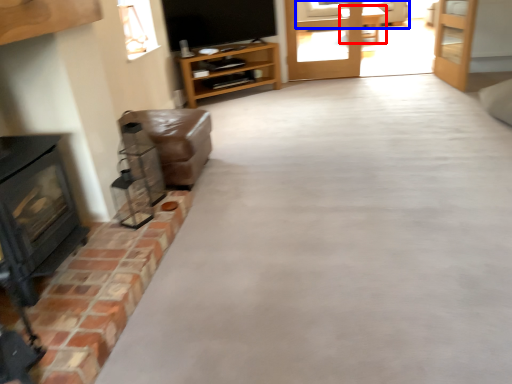
Question: Which object is closer to the camera taking this photo, table (highlighted by a red box) or couch (highlighted by a blue box)?

Choices:
 (A) table
 (B) couch

Answer: (A)